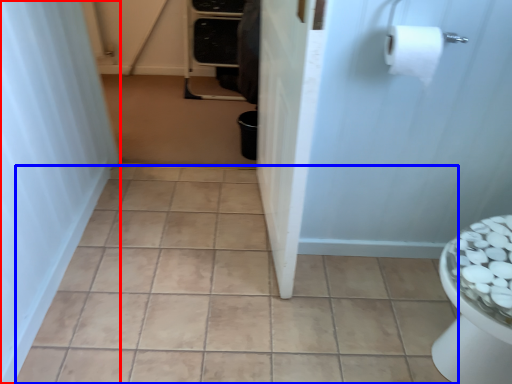
Question: Among these objects, which one is nearest to the camera, shower curtain (highlighted by a red box) or ceramic tile (highlighted by a blue box)?

Choices:
 (A) shower curtain
 (B) ceramic tile

Answer: (A)